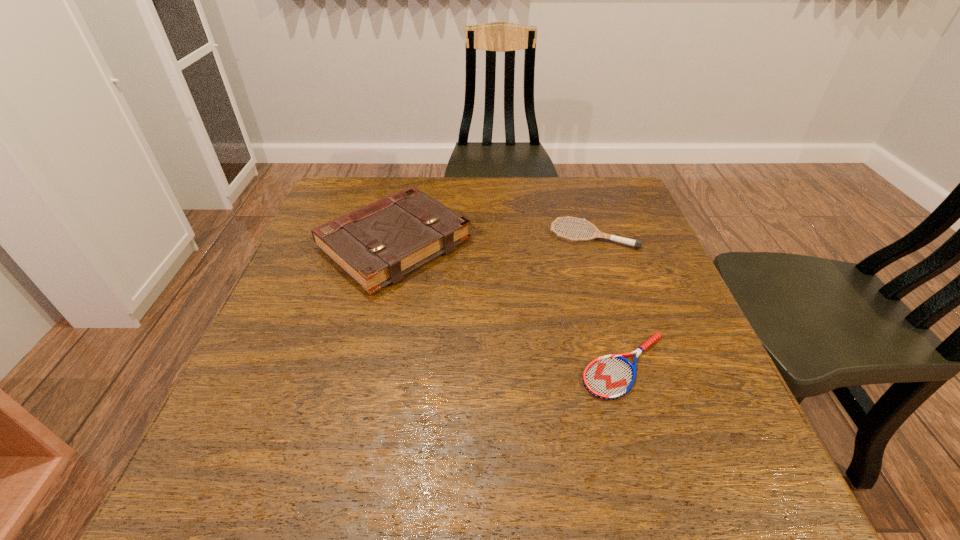
Find the location of a particular element. The width and height of the screenshot is (960, 540). vacant region at the far right corner of the desktop is located at coordinates (621, 201).

What are the coordinates of `free space between the farther tennis racket and the shorter tennis racket` in the screenshot? It's located at (609, 301).

At what (x,y) coordinates should I click in order to perform the action: click on vacant point located between the hardback book and the nearer tennis racket. Please return your answer as a coordinate pair (x, y). The image size is (960, 540). Looking at the image, I should click on (510, 305).

Find the location of a particular element. This screenshot has width=960, height=540. vacant area that lies between the tallest object and the nearer tennis racket is located at coordinates (510, 305).

At what (x,y) coordinates should I click in order to perform the action: click on vacant space that's between the nearer tennis racket and the second tallest object. Please return your answer as a coordinate pair (x, y). The height and width of the screenshot is (540, 960). Looking at the image, I should click on (609, 301).

Where is `unoccupied area between the farther tennis racket and the nearer tennis racket`? Image resolution: width=960 pixels, height=540 pixels. unoccupied area between the farther tennis racket and the nearer tennis racket is located at coordinates (609, 301).

You are a GUI agent. You are given a task and a screenshot of the screen. Output one action in this format:
    pyautogui.click(x=<x>, y=<y>)
    Task: Click on the vacant point located between the shortest object and the farther tennis racket
    This screenshot has height=540, width=960.
    Given the screenshot: What is the action you would take?
    pyautogui.click(x=609, y=301)

The height and width of the screenshot is (540, 960). I want to click on vacant space that is in between the nearest object and the leftmost object, so click(510, 305).

Locate an element on the screen. The image size is (960, 540). free space between the taller tennis racket and the tallest object is located at coordinates (493, 240).

Where is `free point between the shorter tennis racket and the tallest object`? This screenshot has height=540, width=960. free point between the shorter tennis racket and the tallest object is located at coordinates (510, 305).